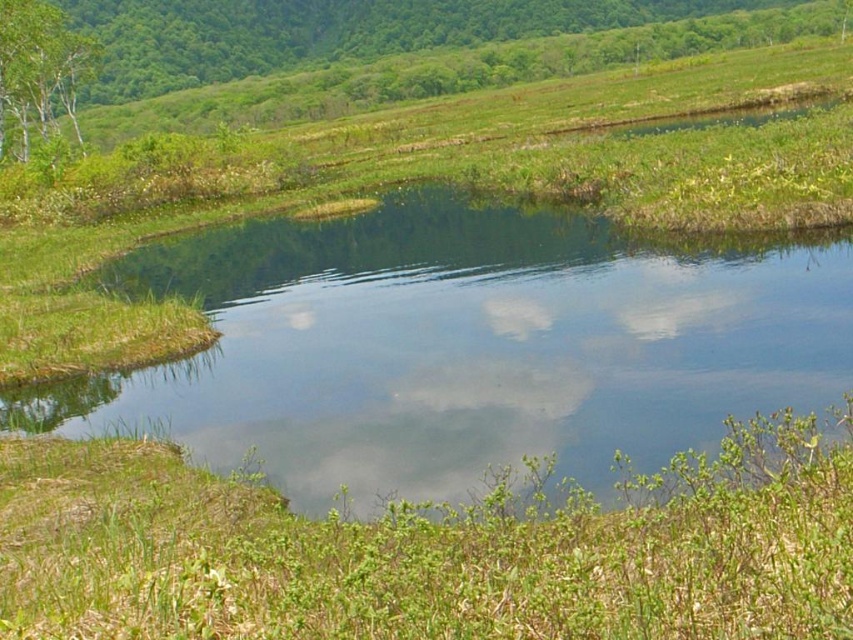
Question: Among these objects, which one is farthest from the camera?

Choices:
 (A) green leafy tree at upper center
 (B) green matte tree at upper left

Answer: (A)

Question: Can you confirm if green leafy tree at upper center is positioned above green matte tree at upper left?

Choices:
 (A) yes
 (B) no

Answer: (A)

Question: Based on their relative distances, which object is nearer to the green leafy grass at lower center?

Choices:
 (A) green leafy tree at upper center
 (B) clear water at center
 (C) green matte tree at upper left

Answer: (B)

Question: Does green leafy grass at lower center have a larger size compared to green matte tree at upper left?

Choices:
 (A) no
 (B) yes

Answer: (A)

Question: Which of the following is the closest to the observer?

Choices:
 (A) (28, 68)
 (B) (260, 579)

Answer: (B)

Question: Is clear water at center positioned behind green leafy tree at upper center?

Choices:
 (A) yes
 (B) no

Answer: (B)